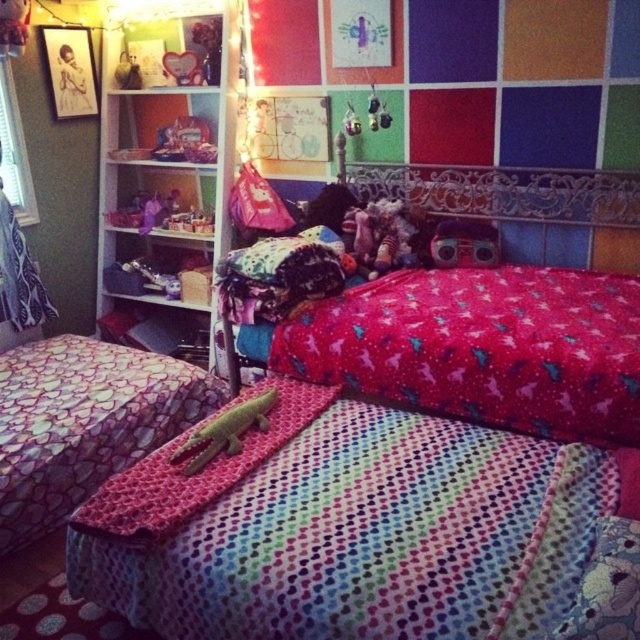
Question: Is multicolored knitted blanket at center below green fabric crocodile at center?

Choices:
 (A) yes
 (B) no

Answer: (A)

Question: Which object is the closest to the multicolored knitted blanket at center?

Choices:
 (A) green fabric crocodile at center
 (B) red fabric bed at center
 (C) matte plastic toy at center

Answer: (A)

Question: Among these objects, which one is farthest from the camera?

Choices:
 (A) green fabric crocodile at center
 (B) red fabric bed at center

Answer: (B)

Question: Is the position of multicolored knitted blanket at center more distant than that of green fabric crocodile at center?

Choices:
 (A) yes
 (B) no

Answer: (B)

Question: Which object appears farthest from the camera in this image?

Choices:
 (A) green fabric crocodile at center
 (B) red fabric bed at center
 (C) matte plastic toy at center
 (D) multicolored knitted blanket at center

Answer: (C)

Question: Is red fabric bed at center closer to the viewer compared to matte plastic toy at center?

Choices:
 (A) yes
 (B) no

Answer: (A)